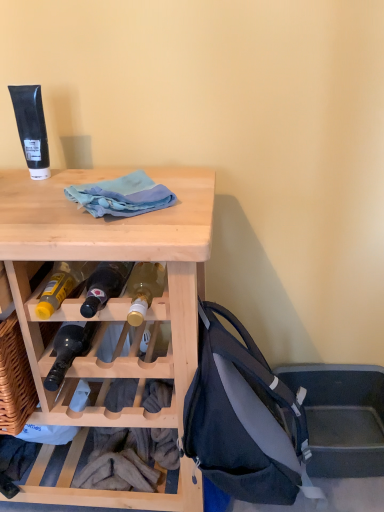
Question: From the image's perspective, is matte black backpack at lower right over light blue fabric at center?

Choices:
 (A) yes
 (B) no

Answer: (B)

Question: Does matte black backpack at lower right have a greater width compared to light blue fabric at center?

Choices:
 (A) no
 (B) yes

Answer: (B)

Question: Is matte black backpack at lower right located outside light blue fabric at center?

Choices:
 (A) yes
 (B) no

Answer: (A)

Question: From a real-world perspective, is matte black backpack at lower right below light blue fabric at center?

Choices:
 (A) yes
 (B) no

Answer: (A)

Question: Is the position of matte black backpack at lower right less distant than that of light blue fabric at center?

Choices:
 (A) yes
 (B) no

Answer: (A)

Question: Does matte black backpack at lower right have a lesser height compared to light blue fabric at center?

Choices:
 (A) yes
 (B) no

Answer: (B)

Question: Considering the relative positions of natural wood desk at upper left and light blue fabric at center in the image provided, is natural wood desk at upper left to the right of light blue fabric at center from the viewer's perspective?

Choices:
 (A) yes
 (B) no

Answer: (B)

Question: Does natural wood desk at upper left appear on the left side of light blue fabric at center?

Choices:
 (A) yes
 (B) no

Answer: (A)

Question: From the image's perspective, is natural wood desk at upper left on light blue fabric at center?

Choices:
 (A) no
 (B) yes

Answer: (A)

Question: Is natural wood desk at upper left facing away from light blue fabric at center?

Choices:
 (A) no
 (B) yes

Answer: (A)

Question: From a real-world perspective, is natural wood desk at upper left physically above light blue fabric at center?

Choices:
 (A) yes
 (B) no

Answer: (B)

Question: Is natural wood desk at upper left further to the viewer compared to light blue fabric at center?

Choices:
 (A) yes
 (B) no

Answer: (B)

Question: Is light blue fabric at center touching natural wood desk at upper left?

Choices:
 (A) yes
 (B) no

Answer: (B)